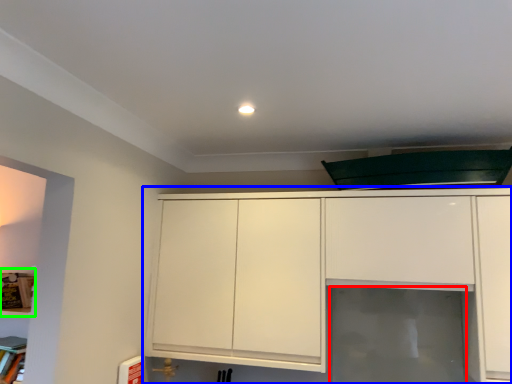
Question: Estimate the real-world distances between objects in this image. Which object is farther from glass door (highlighted by a red box), cabinetry (highlighted by a blue box) or shelf (highlighted by a green box)?

Choices:
 (A) cabinetry
 (B) shelf

Answer: (B)